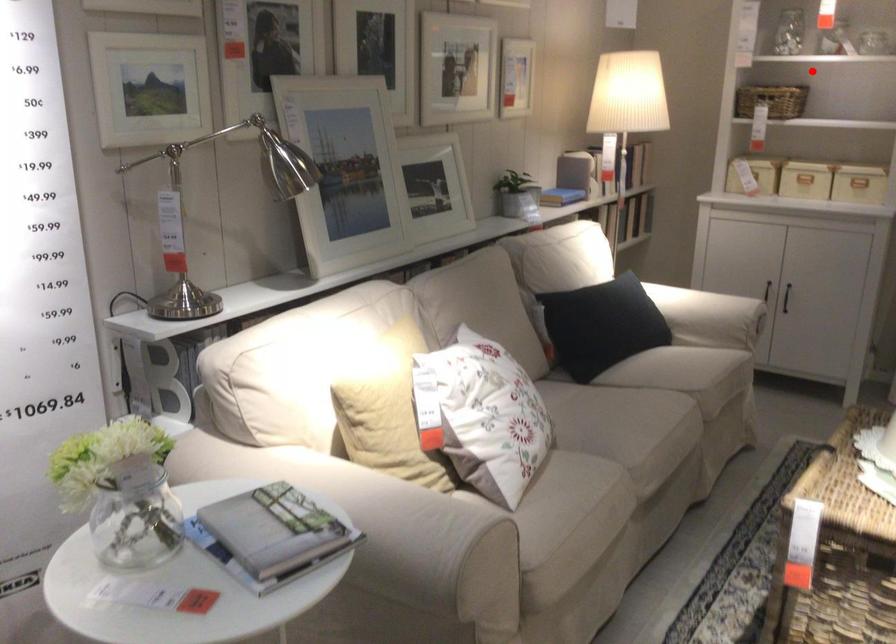
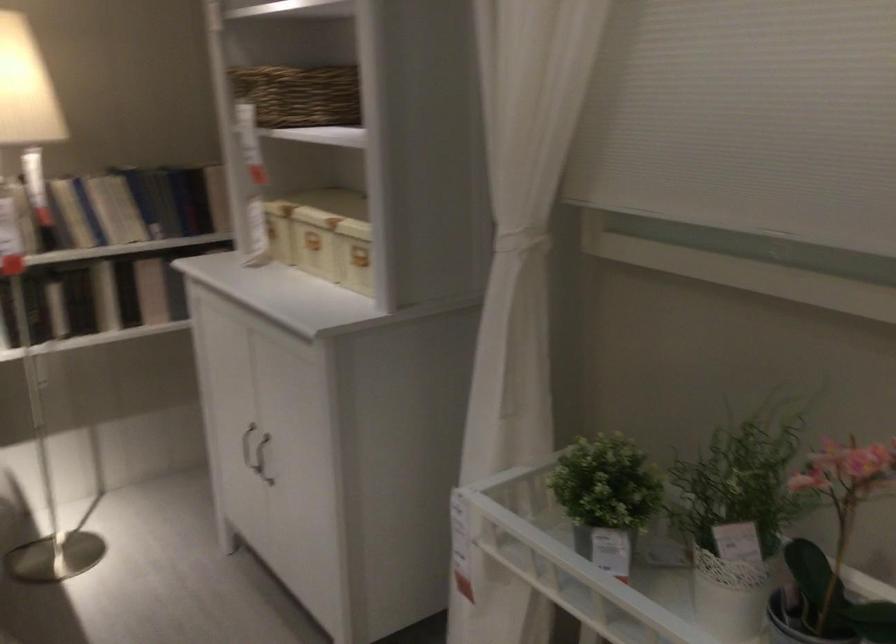
Question: I am providing you with two images of the same scene from different viewpoints. A red point is shown in image1. For the corresponding object point in image2, is it positioned nearer or farther from the camera?

Choices:
 (A) Nearer
 (B) Farther

Answer: (A)